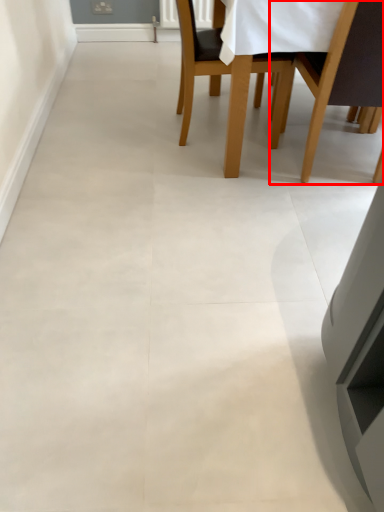
Question: From the image's perspective, what is the correct spatial relationship of chair (annotated by the red box) in relation to chair?

Choices:
 (A) below
 (B) above

Answer: (A)